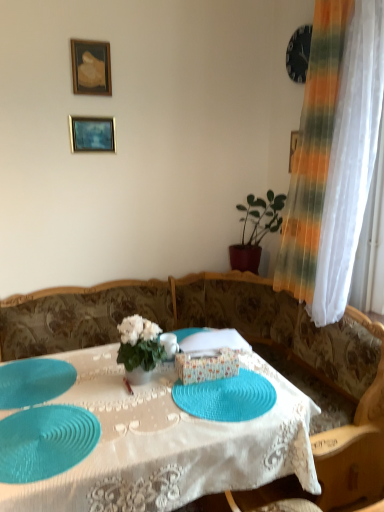
Question: Considering the positions of teal rubber placemat at center and green matte plant at right in the image, is teal rubber placemat at center taller or shorter than green matte plant at right?

Choices:
 (A) short
 (B) tall

Answer: (A)

Question: Would you say teal rubber placemat at center is inside or outside green matte plant at right?

Choices:
 (A) outside
 (B) inside

Answer: (A)

Question: Which object is the farthest from the green matte plant at right?

Choices:
 (A) teal woven placemat at center, which ranks as the first glass plate in right-to-left order
 (B) white fabric flower at center
 (C) teal rubber placemat at lower left, the second glass plate in the right-to-left sequence
 (D) gold-framed painting at upper left, arranged as the first picture frame when viewed from the top
 (E) teal rubber placemat at lower left, positioned as the 1th glass plate in left-to-right order

Answer: (C)

Question: Based on their relative distances, which object is farther from the teal rubber placemat at lower left, acting as the third glass plate starting from the right?

Choices:
 (A) green matte plant at right
 (B) teal rubber placemat at lower left, the second glass plate in the right-to-left sequence
 (C) teal woven placemat at center, the 3th glass plate positioned from the left
 (D) teal rubber placemat at center
 (E) gold-framed painting at upper left, which is the 2th picture frame from bottom to top

Answer: (E)